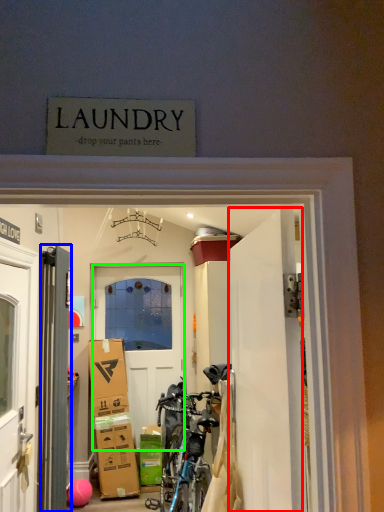
Question: Considering the real-world distances, which object is farthest from door (highlighted by a red box)? door (highlighted by a blue box) or door (highlighted by a green box)?

Choices:
 (A) door
 (B) door

Answer: (B)